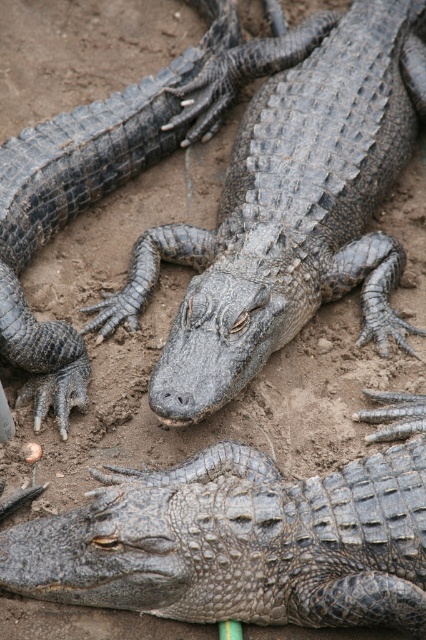
Find the location of a particular element. The width and height of the screenshot is (426, 640). gray scaly crocodile at center is located at coordinates click(285, 202).